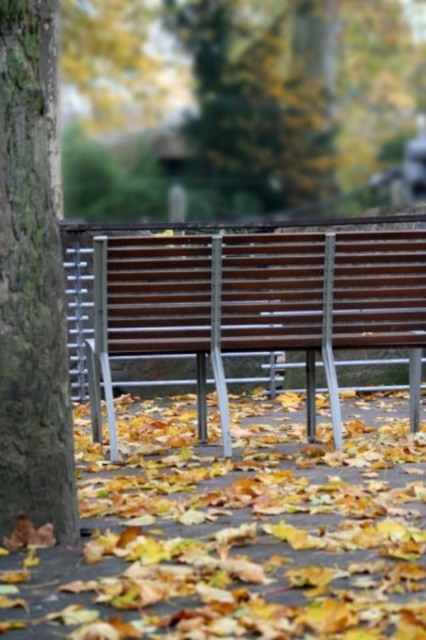
Measure the distance between wooden bench at center and camera.

wooden bench at center and camera are 4.65 meters apart.

Does wooden bench at center come behind smooth bark tree at left?

Yes, wooden bench at center is further from the viewer.

What do you see at coordinates (256, 307) in the screenshot? The width and height of the screenshot is (426, 640). I see `wooden bench at center` at bounding box center [256, 307].

In order to click on wooden bench at center in this screenshot , I will do tap(256, 307).

Who is higher up, yellow leaf litter at lower center or smooth bark tree at left?

smooth bark tree at left is higher up.

This screenshot has height=640, width=426. What do you see at coordinates (236, 529) in the screenshot?
I see `yellow leaf litter at lower center` at bounding box center [236, 529].

Is point (28, 616) farther from viewer compared to point (20, 221)?

No, (28, 616) is in front of (20, 221).

This screenshot has width=426, height=640. I want to click on yellow leaf litter at lower center, so click(236, 529).

Is yellow leaf litter at lower center shorter than wooden bench at center?

Yes, yellow leaf litter at lower center is shorter than wooden bench at center.

This screenshot has width=426, height=640. Find the location of `yellow leaf litter at lower center`. yellow leaf litter at lower center is located at coordinates (236, 529).

Is point (267, 513) farther from camera compared to point (290, 292)?

No.

Find the location of a particular element. Image resolution: width=426 pixels, height=640 pixels. yellow leaf litter at lower center is located at coordinates (236, 529).